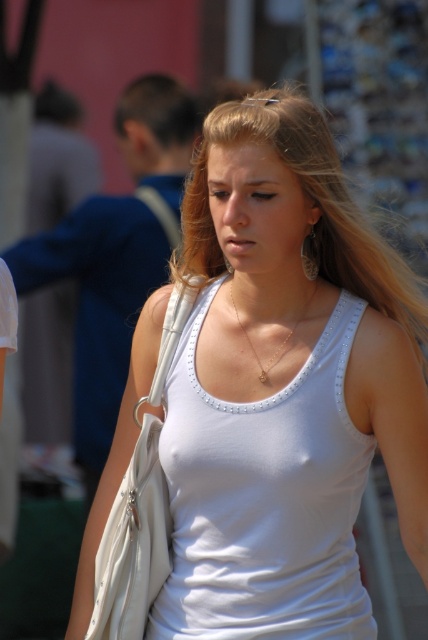
You are a photographer trying to capture a closeup of the woman in the scene. You need to decide whether to focus on the dark brown hair at upper left or the gold chain necklace at center. Which object should you choose if you want to capture the larger one in your shot?

The dark brown hair at upper left is larger in width than the gold chain necklace at center, so you should focus on the dark brown hair at upper left to capture the larger one.

The woman in the image has blonde hair at center and a gold chain necklace at center. Which object is positioned higher on her body?

The blonde hair at center is located above the gold chain necklace at center, so the blonde hair at center is higher on her body.

The woman in the image has blonde hair at center and a gold chain necklace at center. Which of these two items has a greater width?

The blonde hair at center has a greater width than the gold chain necklace at center.